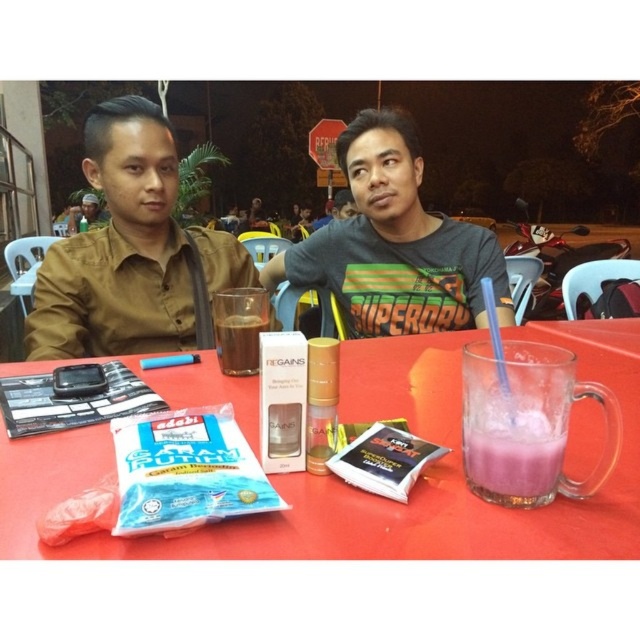
Question: Among these points, which one is farthest from the camera?

Choices:
 (A) (474, 419)
 (B) (248, 365)

Answer: (B)

Question: From the image, what is the correct spatial relationship of purple translucent glass at lower right in relation to translucent glass cup at center?

Choices:
 (A) below
 (B) above

Answer: (A)

Question: Is matte brown shirt at left bigger than purple translucent glass at lower right?

Choices:
 (A) no
 (B) yes

Answer: (B)

Question: Is transparent plastic table at center to the right of matte black shirt at left from the viewer's perspective?

Choices:
 (A) yes
 (B) no

Answer: (A)

Question: Which of the following is the farthest from the observer?

Choices:
 (A) matte black shirt at left
 (B) transparent plastic table at center
 (C) gray cotton t-shirt at center
 (D) matte brown shirt at left

Answer: (A)

Question: Which point appears closest to the camera in this image?

Choices:
 (A) (376, 317)
 (B) (250, 323)
 (C) (401, 518)

Answer: (C)